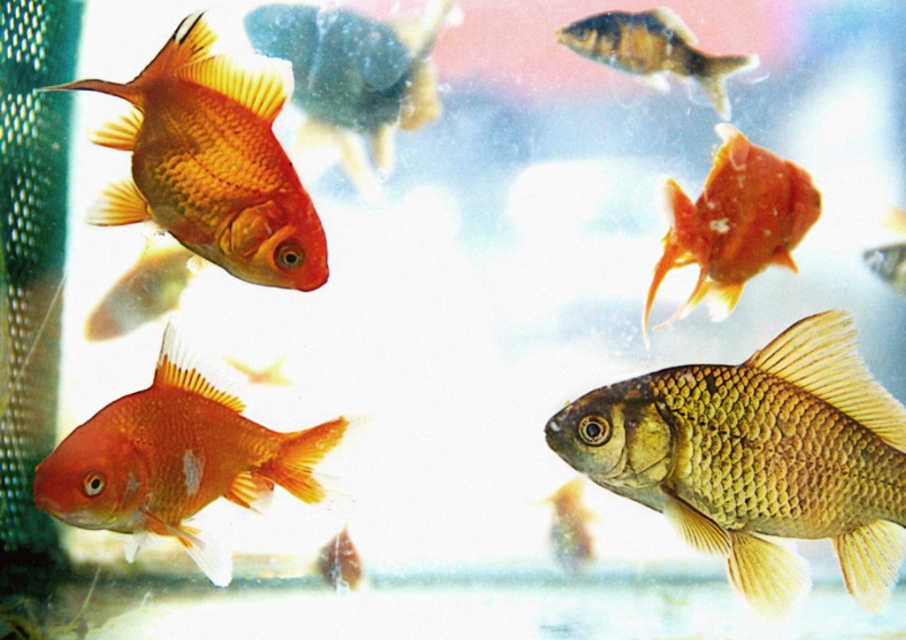
Consider the image. Who is positioned more to the right, matte goldfish at left or matte orange goldfish at lower left?

matte goldfish at left

Which is more to the left, matte goldfish at left or matte orange goldfish at lower left?

Positioned to the left is matte orange goldfish at lower left.

Which is in front, point (149, 90) or point (198, 368)?

Positioned in front is point (149, 90).

This screenshot has height=640, width=906. Identify the location of matte goldfish at left. (210, 163).

Is shiny golden fish at center wider than matte orange goldfish at lower left?

Indeed, shiny golden fish at center has a greater width compared to matte orange goldfish at lower left.

Between point (659, 461) and point (147, 392), which one is positioned behind?

Point (147, 392)

You are a GUI agent. You are given a task and a screenshot of the screen. Output one action in this format:
    pyautogui.click(x=<x>, y=<y>)
    Task: Click on the shiny golden fish at center
    
    Given the screenshot: What is the action you would take?
    pyautogui.click(x=758, y=458)

Which is below, shiny golden fish at center or matte goldfish at left?

shiny golden fish at center is below.

Is point (868, 515) closer to viewer compared to point (229, 179)?

Yes, point (868, 515) is in front of point (229, 179).

Image resolution: width=906 pixels, height=640 pixels. In order to click on shiny golden fish at center in this screenshot , I will do `click(758, 458)`.